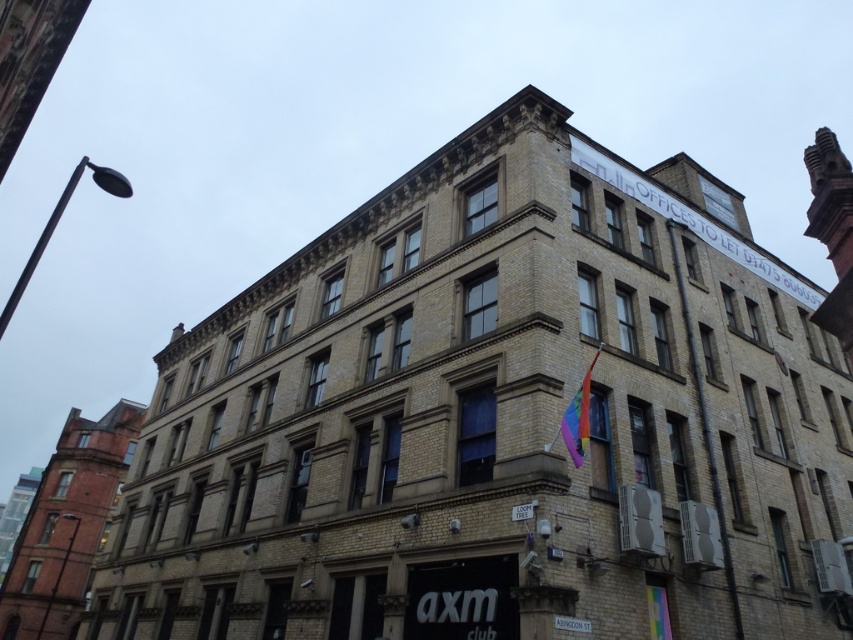
You are a delivery person approaching the building and need to locate the entrance. You see the rainbow fabric flag at upper right and the white plastic sign at lower center. Which object is positioned higher up on the building?

The rainbow fabric flag at upper right is located above the white plastic sign at lower center, so it is positioned higher up on the building.

You are a delivery person trying to park your van near the building. You need to know which object on the building facade is wider so you can position your vehicle accordingly. Which one is wider between the rainbow fabric flag at upper right and the white plastic sign at lower center?

The rainbow fabric flag at upper right is wider than the white plastic sign at lower center according to the description.